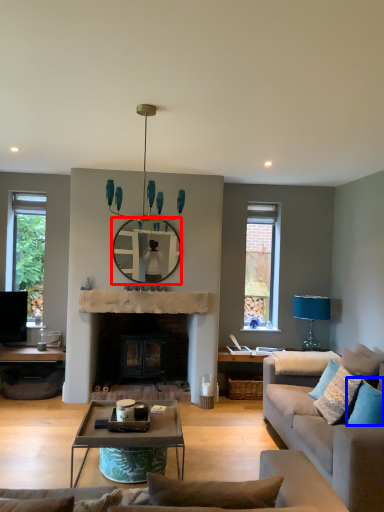
Question: Which object appears closest to the camera in this image, mirror (highlighted by a red box) or pillow (highlighted by a blue box)?

Choices:
 (A) mirror
 (B) pillow

Answer: (B)